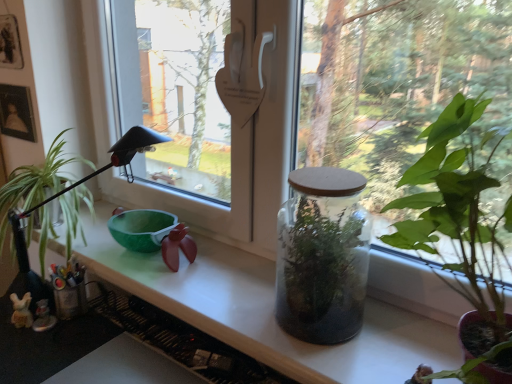
Question: Is transparent glass jar at center positioned before translucent glass jar at center?

Choices:
 (A) no
 (B) yes

Answer: (B)

Question: Is transparent glass jar at center located outside translucent glass jar at center?

Choices:
 (A) yes
 (B) no

Answer: (A)

Question: Can you confirm if transparent glass jar at center is bigger than translucent glass jar at center?

Choices:
 (A) yes
 (B) no

Answer: (A)

Question: From a real-world perspective, does transparent glass jar at center sit lower than translucent glass jar at center?

Choices:
 (A) yes
 (B) no

Answer: (B)

Question: Is transparent glass jar at center facing away from translucent glass jar at center?

Choices:
 (A) no
 (B) yes

Answer: (A)

Question: Is transparent glass jar at center in contact with translucent glass jar at center?

Choices:
 (A) no
 (B) yes

Answer: (A)

Question: Does transparent glass jar at center turn towards translucent glass terrarium at center, marked as the first houseplant in a right-to-left arrangement?

Choices:
 (A) yes
 (B) no

Answer: (B)

Question: Is transparent glass jar at center outside of translucent glass terrarium at center, marked as the first houseplant in a right-to-left arrangement?

Choices:
 (A) yes
 (B) no

Answer: (A)

Question: Is transparent glass jar at center far away from translucent glass terrarium at center, arranged as the 1th houseplant when viewed from the front?

Choices:
 (A) yes
 (B) no

Answer: (B)

Question: From the image's perspective, would you say transparent glass jar at center is shown under translucent glass terrarium at center, the 2th houseplant from the left?

Choices:
 (A) no
 (B) yes

Answer: (A)

Question: Does transparent glass jar at center have a lesser width compared to translucent glass terrarium at center, marked as the first houseplant in a right-to-left arrangement?

Choices:
 (A) yes
 (B) no

Answer: (A)

Question: Is transparent glass jar at center wider than translucent glass terrarium at center, marked as the first houseplant in a right-to-left arrangement?

Choices:
 (A) no
 (B) yes

Answer: (A)

Question: Would you say transparent glass jar at center is outside translucent glass jar at center?

Choices:
 (A) no
 (B) yes

Answer: (B)